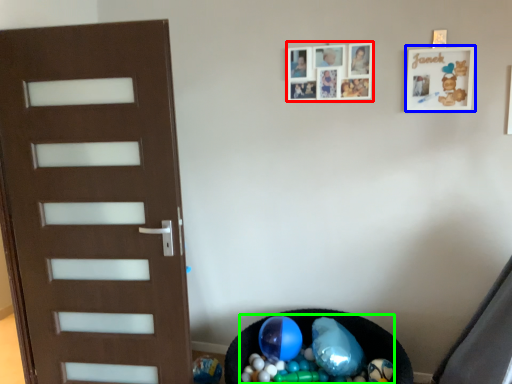
Question: Estimate the real-world distances between objects in this image. Which object is farther from picture frame (highlighted by a red box), picture frame (highlighted by a blue box) or garbage (highlighted by a green box)?

Choices:
 (A) picture frame
 (B) garbage

Answer: (B)